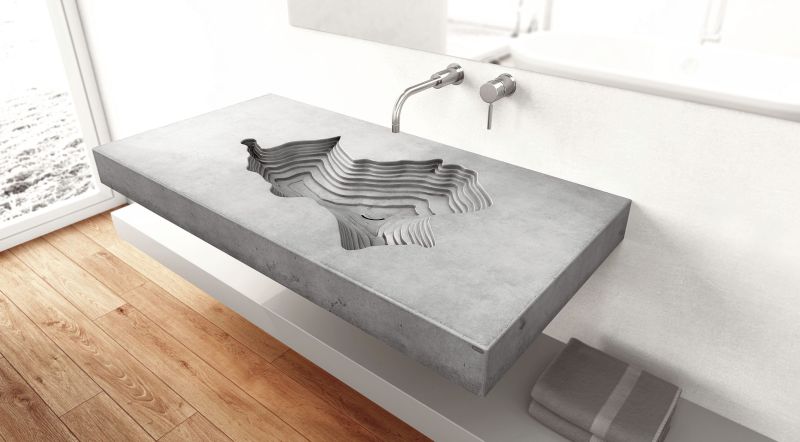
Where is `longer faucet nozzle`? longer faucet nozzle is located at coordinates (405, 101).